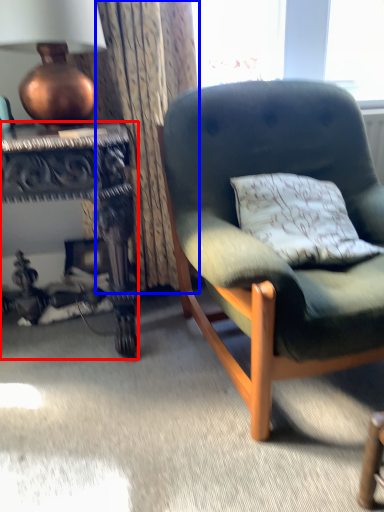
Question: Which point is further to the camera, desk (highlighted by a red box) or curtain (highlighted by a blue box)?

Choices:
 (A) desk
 (B) curtain

Answer: (B)